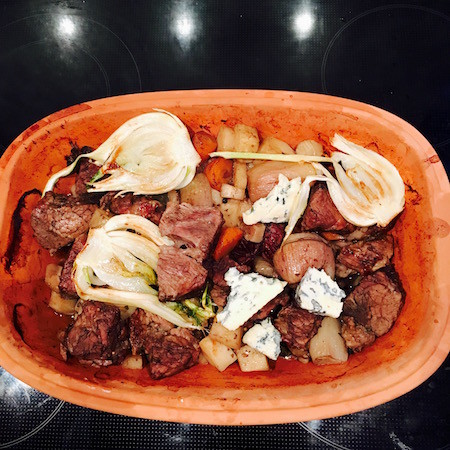
Find the location of `burners`. burners is located at coordinates (15, 399), (413, 421), (400, 65), (52, 74).